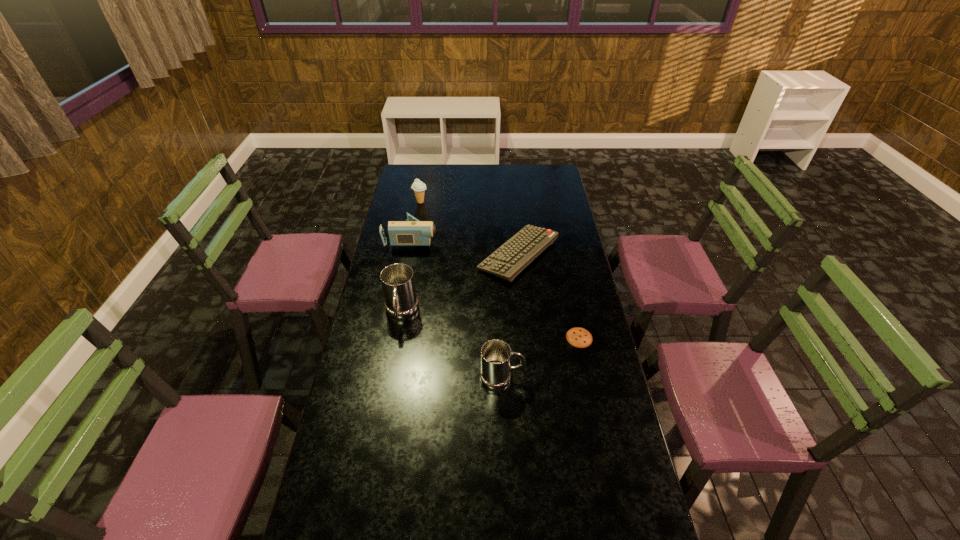
This screenshot has width=960, height=540. In order to click on free space located 0.190m on the left of the second shortest object in this screenshot , I will do `click(435, 255)`.

Image resolution: width=960 pixels, height=540 pixels. Find the location of `vacant space situated 0.120m on the back of the icecream`. vacant space situated 0.120m on the back of the icecream is located at coordinates (423, 186).

I want to click on free space located 0.260m on the side of the camcorder with the flip-out screen, so click(x=493, y=239).

The image size is (960, 540). What are the coordinates of `free space located 0.240m on the left of the cookie` in the screenshot? It's located at (502, 338).

The height and width of the screenshot is (540, 960). I want to click on mug that is positioned at the left edge, so click(x=401, y=302).

You are a GUI agent. You are given a task and a screenshot of the screen. Output one action in this format:
    pyautogui.click(x=<x>, y=<y>)
    Task: Click on the icecream that is positioned at the left edge
    
    Given the screenshot: What is the action you would take?
    pyautogui.click(x=419, y=187)

The width and height of the screenshot is (960, 540). Identify the location of camcorder that is at the left edge. (412, 232).

The height and width of the screenshot is (540, 960). I want to click on computer keyboard that is at the right edge, so click(x=506, y=262).

This screenshot has height=540, width=960. Find the location of `cookie located in the right edge section of the desktop`. cookie located in the right edge section of the desktop is located at coordinates (579, 337).

This screenshot has height=540, width=960. Find the location of `vacant space at the far edge of the desktop`. vacant space at the far edge of the desktop is located at coordinates pos(507,165).